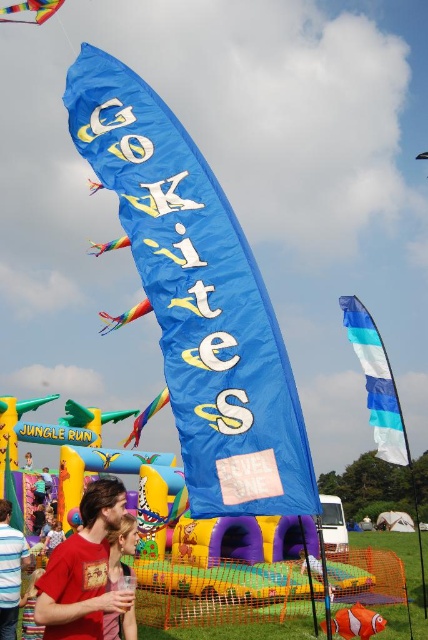
Does matte red shirt at lower left appear under multicolored fabric kite at upper left?

Yes, matte red shirt at lower left is below multicolored fabric kite at upper left.

Looking at this image, who is more forward, [112,637] or [26,19]?

Positioned in front is point [112,637].

Which is behind, point (127, 520) or point (33, 12)?

The point (33, 12) is behind.

This screenshot has height=640, width=428. I want to click on matte red shirt at lower left, so click(x=121, y=548).

Measure the distance between blue fabric sail at center and red shirt at lower left.

blue fabric sail at center is 98.55 feet away from red shirt at lower left.

Which is below, blue fabric sail at center or red shirt at lower left?

red shirt at lower left

Locate an element on the screen. This screenshot has width=428, height=640. blue fabric sail at center is located at coordinates (377, 381).

Is point (17, 604) farther from camera compared to point (356, 634)?

Yes, point (17, 604) is behind point (356, 634).

Is red shirt at lower left positioned before orange matte clownfish at lower center?

No, it is not.

Which is in front, point (11, 557) or point (371, 634)?

Positioned in front is point (371, 634).

What are the coordinates of `red shirt at lower left` in the screenshot? It's located at (9, 572).